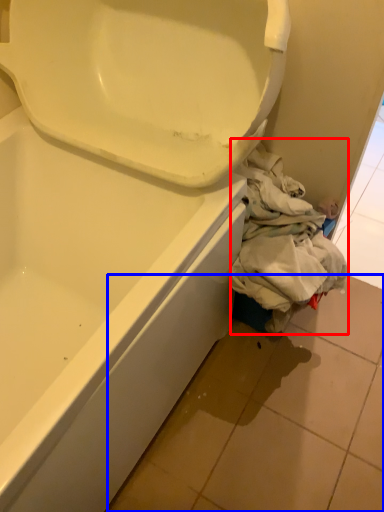
Question: Which object appears farthest to the camera in this image, clothing (highlighted by a red box) or tile (highlighted by a blue box)?

Choices:
 (A) clothing
 (B) tile

Answer: (A)